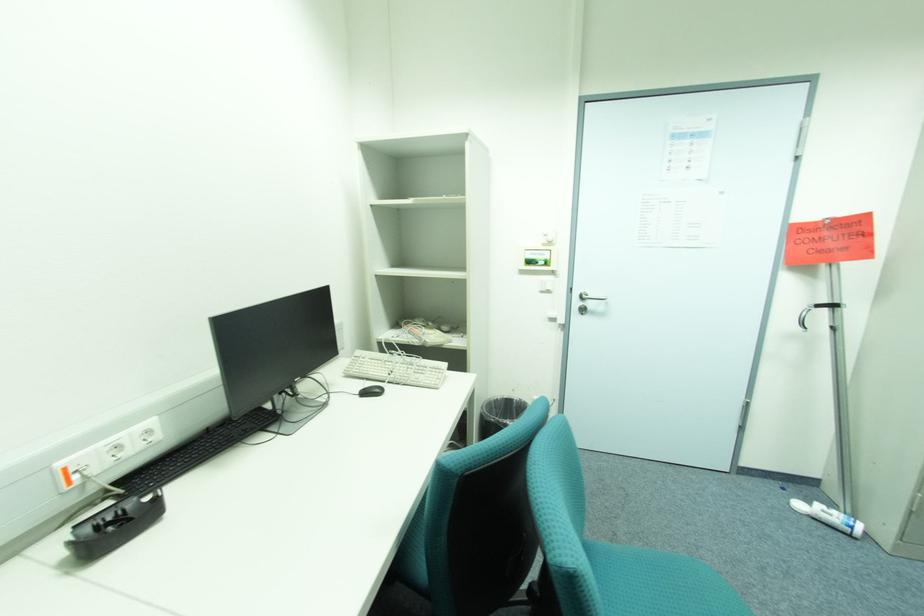
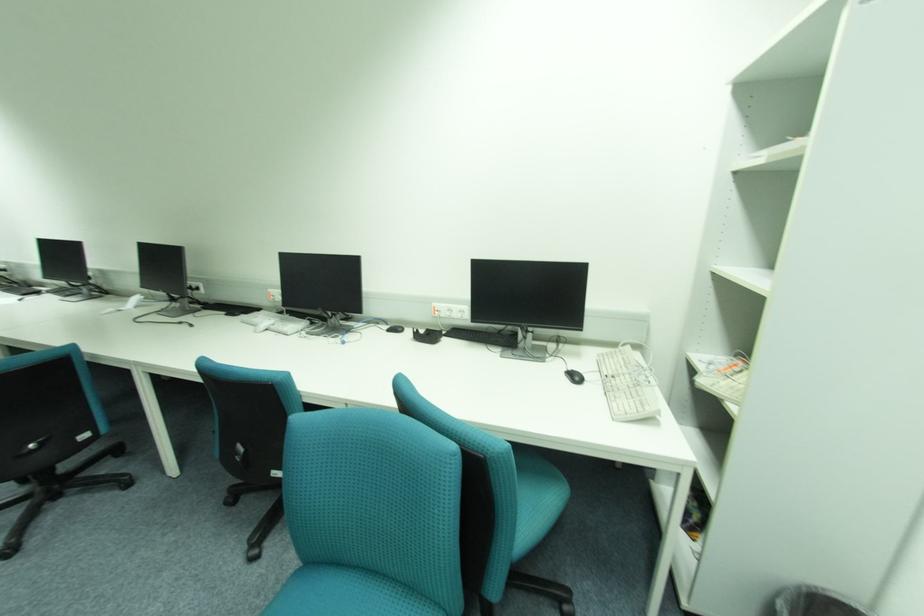
In the second image, find the point that corresponds to the point at 420,373 in the first image.

(631, 392)